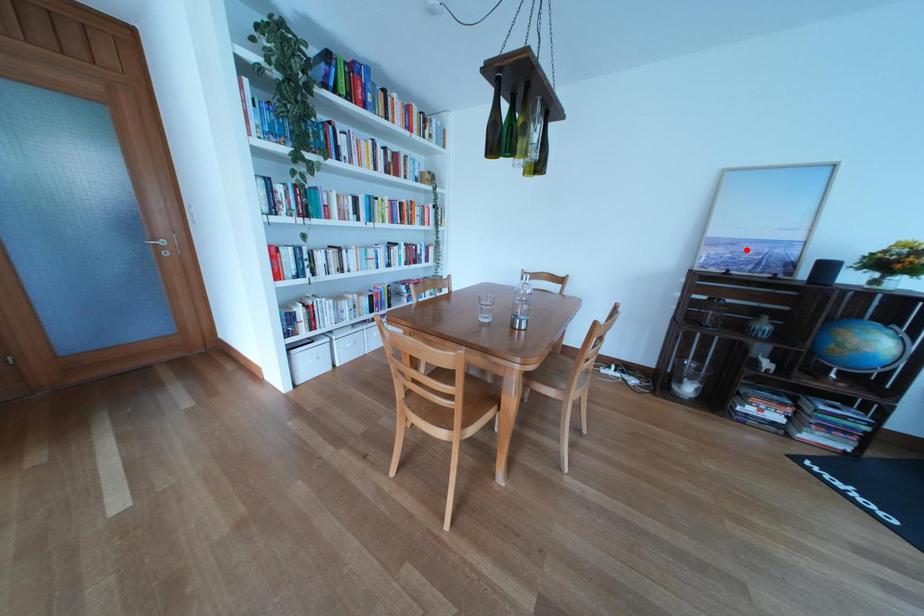
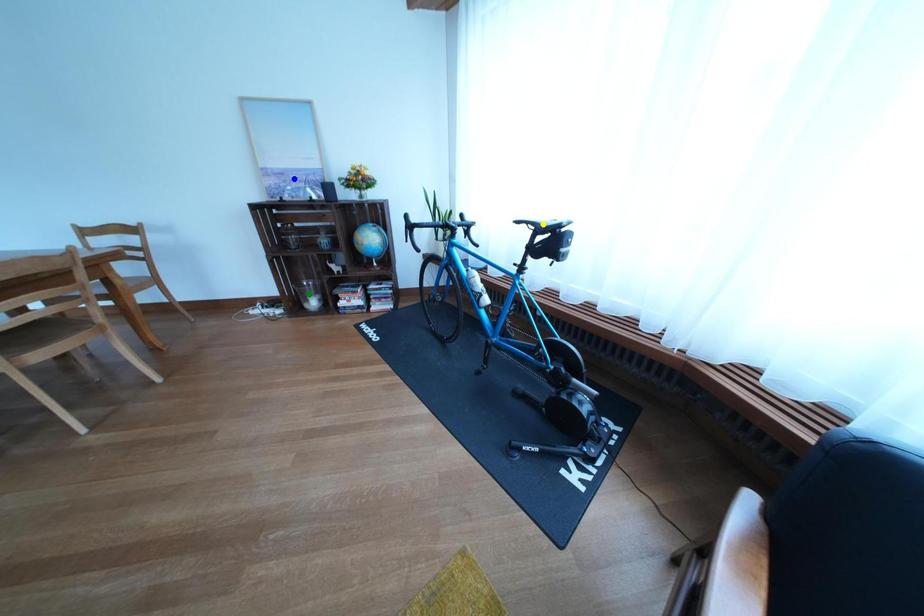
Question: I am providing you with two images of the same scene from different viewpoints. A red point is marked on the first image. You are given multiple points on the second image. Can you choose the point in image 2 that corresponds to the point in image 1?

Choices:
 (A) green point
 (B) blue point
 (C) yellow point

Answer: (B)